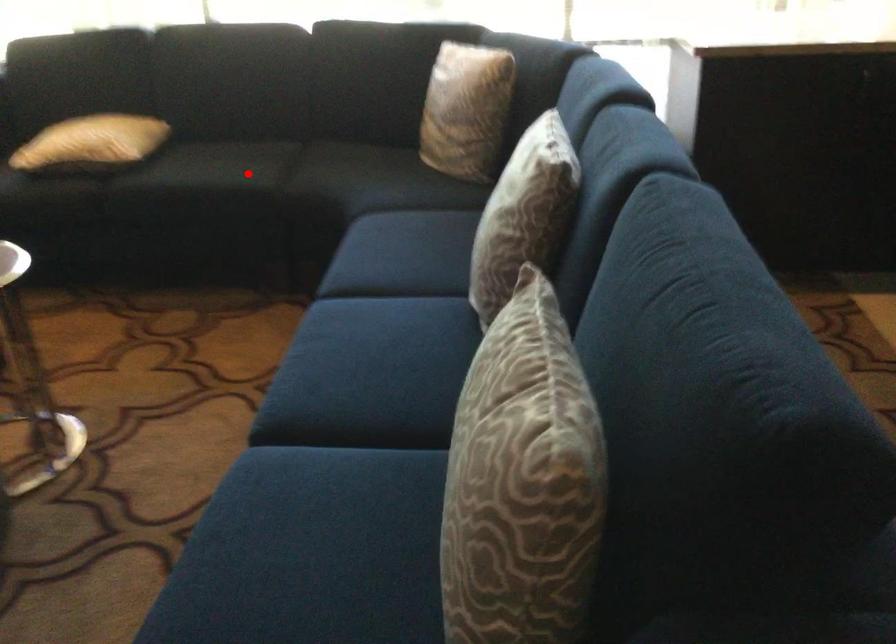
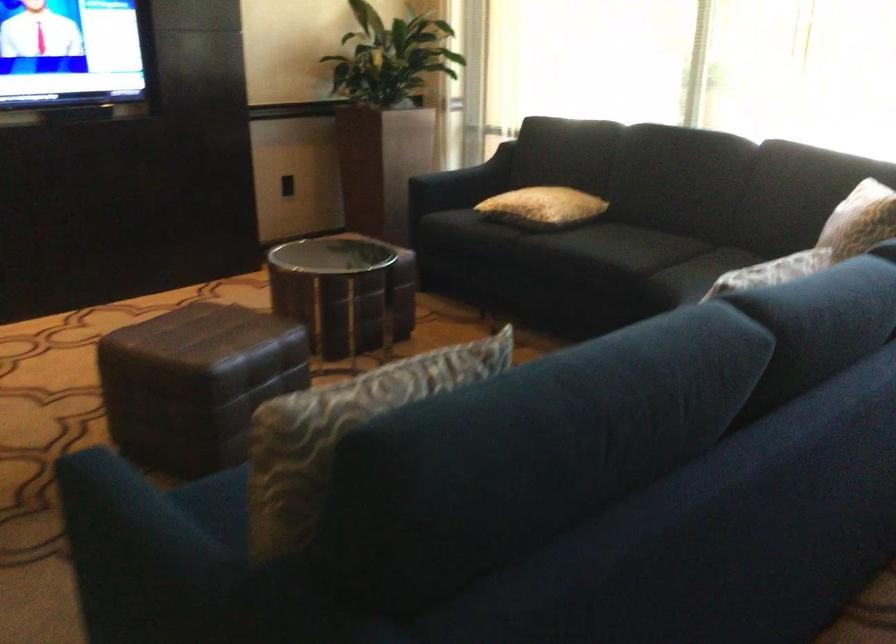
Find the pixel in the second image that matches the highlighted location in the first image.

(626, 254)